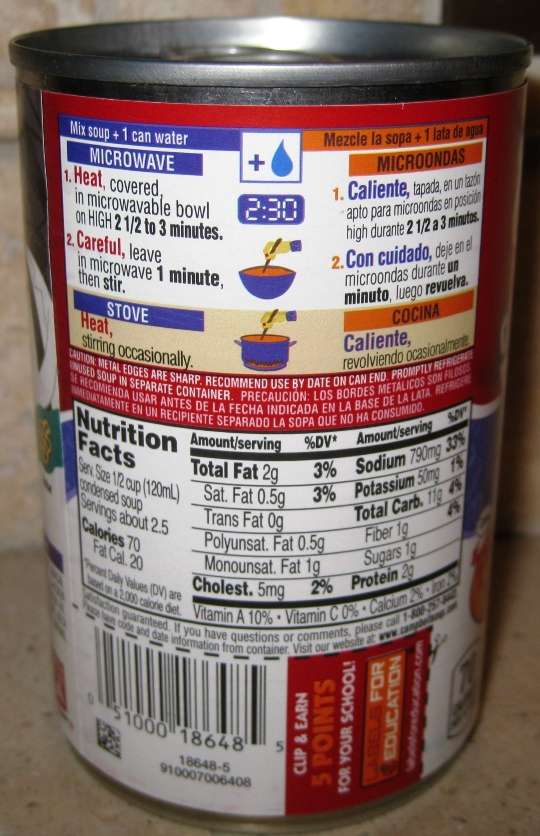
The width and height of the screenshot is (540, 836). I want to click on pot, so pos(274,349).